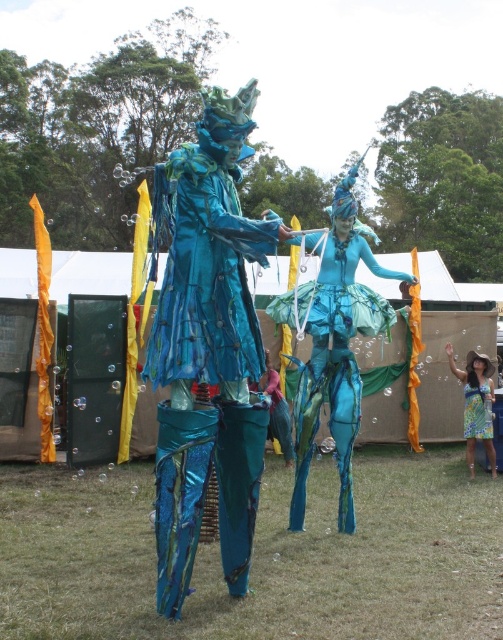
You are a photographer at a festival. You want to take a photo of the metallic blue costume at center. Where should you position your camera to capture it best?

To capture the metallic blue costume at center best, position your camera near the center of the scene, around the coordinates mentioned at point 0.537 on the x and 0.664 on the y axis.